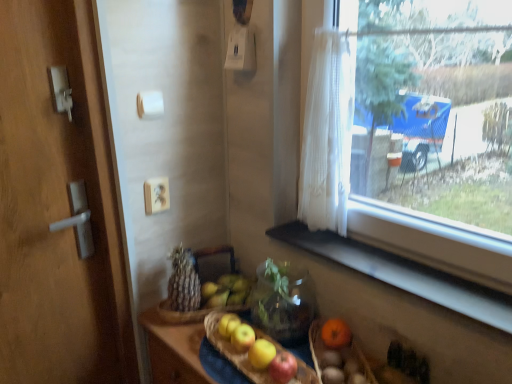
Where is `free spot above wooden basket at lower center, the first basket viewed from the left (from a real-world perspective)`? This screenshot has width=512, height=384. free spot above wooden basket at lower center, the first basket viewed from the left (from a real-world perspective) is located at coordinates coord(253,344).